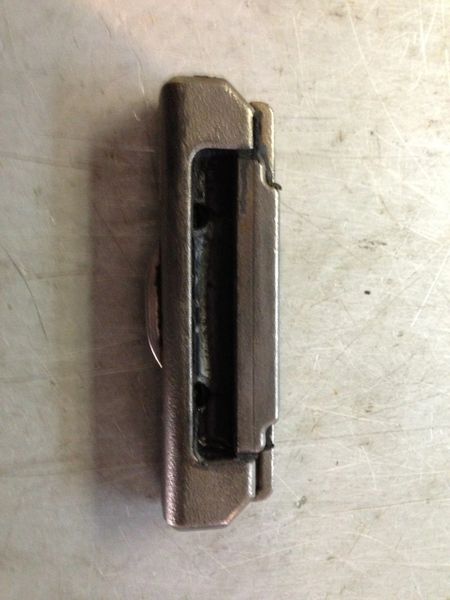
Locate an element on the screen. This screenshot has width=450, height=600. scratches in metal table is located at coordinates (432, 285), (414, 232), (372, 193), (396, 135), (301, 66), (365, 452).